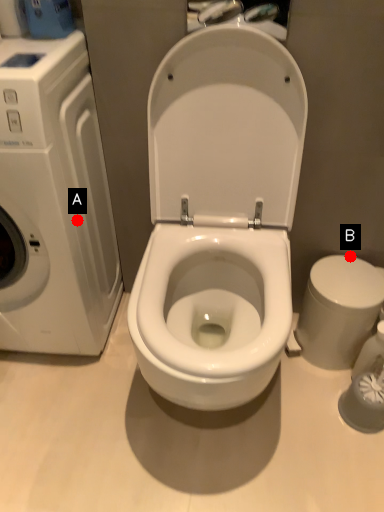
Question: Two points are circled on the image, labeled by A and B beside each circle. Which point is further to the camera?

Choices:
 (A) A is further
 (B) B is further

Answer: (B)